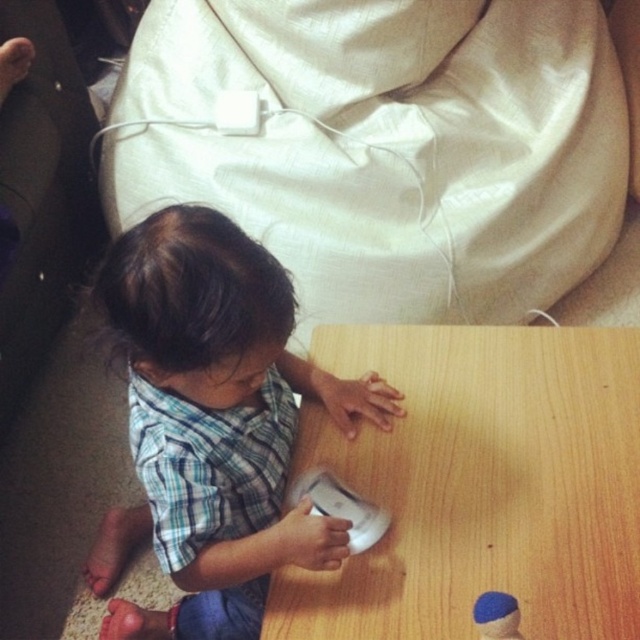
You are a furniture designer observing the scene. The wooden table at center and the blue plaid shirt at center are both in the image. Which object is taller?

The blue plaid shirt at center is taller than the wooden table at center.

In the scene shown: You are a parent trying to place a blue felt hat at lower right on the wooden table at center. Can you place the hat on the table without moving any other objects?

The wooden table at center is to the right of the blue felt hat at lower right, so you can place the hat on the table by moving it to the right without disturbing other objects.

You are a photographer setting up for a portrait. You need to position a light source to the left of the wooden table at center and to the right of the blue plaid shirt at center. Is this possible based on the scene?

The wooden table at center is to the right of the blue plaid shirt at center, so placing a light source to the left of the wooden table at center and to the right of the blue plaid shirt at center is possible since there is space between them.